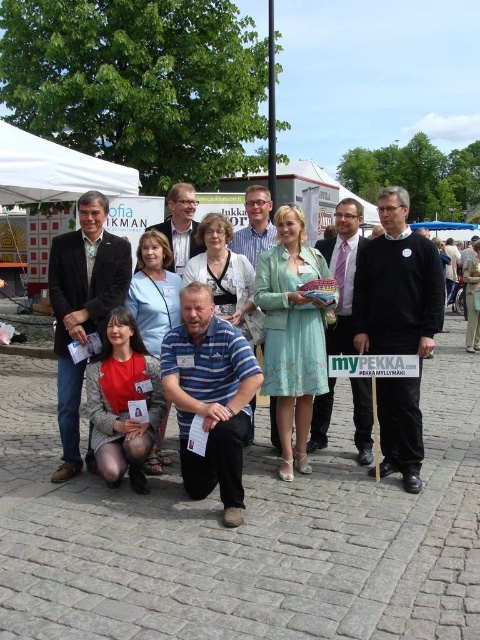
You are a photographer adjusting your camera settings. You notice the light blue fabric dress at center and the blue fabric canopy at upper center in your frame. Which object appears smaller in the photo?

The light blue fabric dress at center appears smaller in the photo compared to the blue fabric canopy at upper center because it has a smaller size.

You are a photographer trying to adjust the lighting for a group photo. You notice the light blue fabric dress at center and the white fabric canopy at upper left. How far apart are these two items in meters?

The light blue fabric dress at center is 4.18 meters from the white fabric canopy at upper left.

You are standing in front of the group of ten individuals at the event. You notice two points marked in the scene. Which point, point (216, 481) or point (14, 173), is closer to you?

Point (216, 481) is closer to the viewer than point (14, 173).